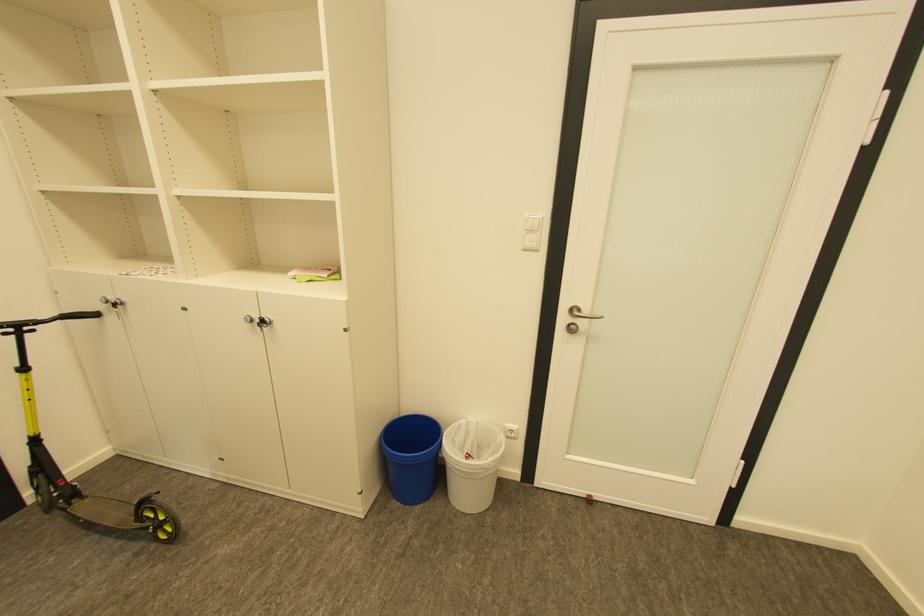
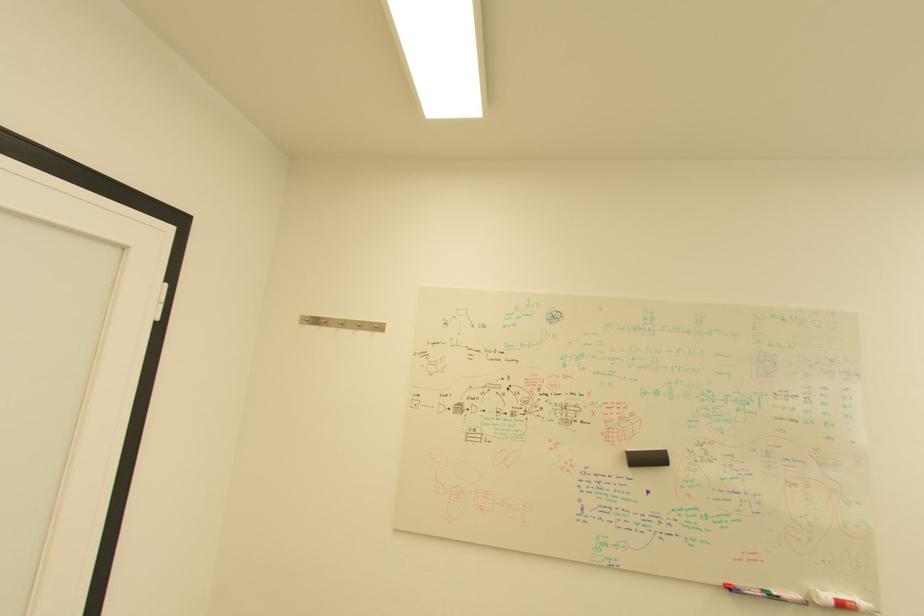
Question: The first image is from the beginning of the video and the second image is from the end. How did the camera likely rotate when shooting the video?

Choices:
 (A) Left
 (B) Right
 (C) Up
 (D) Down

Answer: (B)